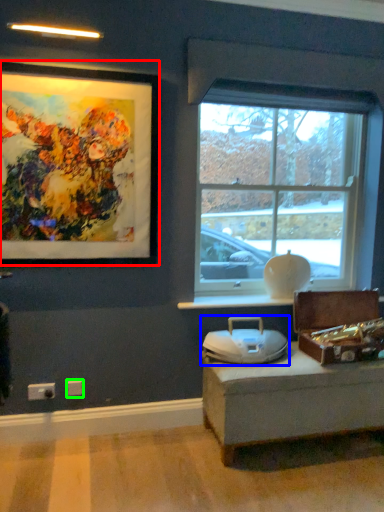
Question: Estimate the real-world distances between objects in this image. Which object is closer to picture frame (highlighted by a red box), swivel chair (highlighted by a blue box) or electric outlet (highlighted by a green box)?

Choices:
 (A) swivel chair
 (B) electric outlet

Answer: (A)